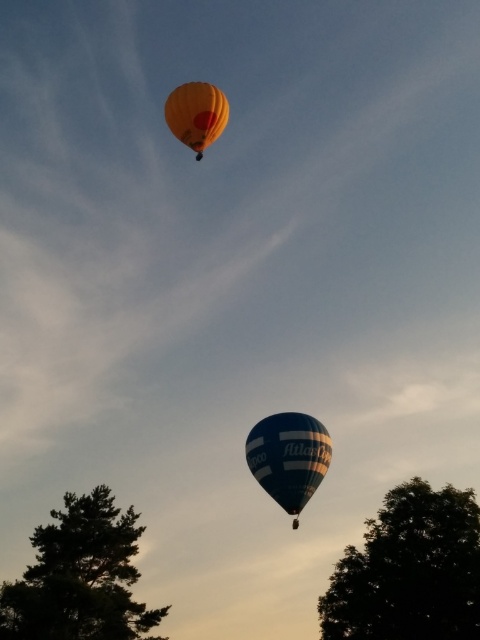
Is blue striped fabric hot air balloon at lower center positioned before yellow fabric balloon at upper center?

Yes, it is in front of yellow fabric balloon at upper center.

Does blue striped fabric hot air balloon at lower center have a greater width compared to yellow fabric balloon at upper center?

Indeed, blue striped fabric hot air balloon at lower center has a greater width compared to yellow fabric balloon at upper center.

The image size is (480, 640). What do you see at coordinates (288, 456) in the screenshot?
I see `blue striped fabric hot air balloon at lower center` at bounding box center [288, 456].

Identify the location of blue striped fabric hot air balloon at lower center. (288, 456).

Which is more to the right, green leafy tree at lower left or blue striped fabric hot air balloon at lower center?

blue striped fabric hot air balloon at lower center is more to the right.

Does green leafy tree at lower left have a greater height compared to blue striped fabric hot air balloon at lower center?

Correct, green leafy tree at lower left is much taller as blue striped fabric hot air balloon at lower center.

The image size is (480, 640). What do you see at coordinates (80, 577) in the screenshot?
I see `green leafy tree at lower left` at bounding box center [80, 577].

Find the location of a particular element. This screenshot has height=640, width=480. green leafy tree at lower left is located at coordinates (80, 577).

Can you confirm if dark green leafy tree at lower right is taller than green leafy tree at lower left?

Indeed, dark green leafy tree at lower right has a greater height compared to green leafy tree at lower left.

Does dark green leafy tree at lower right appear on the left side of green leafy tree at lower left?

In fact, dark green leafy tree at lower right is to the right of green leafy tree at lower left.

Is point (324, 614) farther from camera compared to point (97, 513)?

Yes.

Where is `dark green leafy tree at lower right`? The image size is (480, 640). dark green leafy tree at lower right is located at coordinates (409, 570).